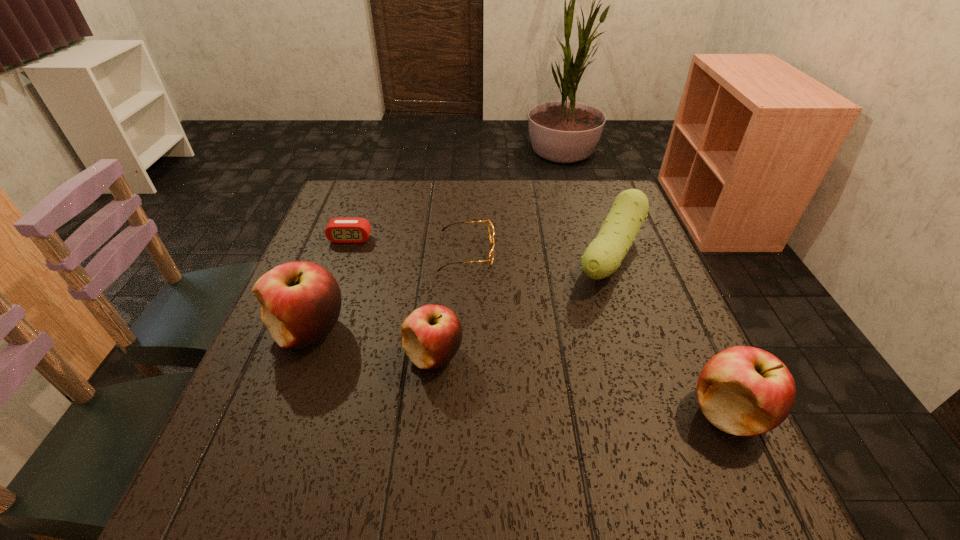
You are a GUI agent. You are given a task and a screenshot of the screen. Output one action in this format:
    pyautogui.click(x=<x>, y=<y>)
    Task: Click on the apple that is the third closest to the alarm clock
    
    Given the screenshot: What is the action you would take?
    pyautogui.click(x=744, y=391)

Locate an element on the screen. This screenshot has height=540, width=960. vacant space that satisfies the following two spatial constraints: 1. on the front-facing side of the spectacles; 2. on the right side of the cucumber is located at coordinates (467, 255).

The image size is (960, 540). Find the location of `vacant position in the image that satisfies the following two spatial constraints: 1. on the front-facing side of the second apple from right to left; 2. on the left side of the alarm clock`. vacant position in the image that satisfies the following two spatial constraints: 1. on the front-facing side of the second apple from right to left; 2. on the left side of the alarm clock is located at coordinates (308, 355).

In order to click on free space that satisfies the following two spatial constraints: 1. on the back side of the cucumber; 2. on the front-facing side of the spectacles in this screenshot , I will do `click(610, 252)`.

You are a GUI agent. You are given a task and a screenshot of the screen. Output one action in this format:
    pyautogui.click(x=<x>, y=<y>)
    Task: Click on the free space that satisfies the following two spatial constraints: 1. on the front-facing side of the alarm clock; 2. on the left side of the rightmost apple
    
    Given the screenshot: What is the action you would take?
    pyautogui.click(x=288, y=412)

Image resolution: width=960 pixels, height=540 pixels. Find the location of `vacant space that satisfies the following two spatial constraints: 1. on the front-facing side of the alarm clock; 2. on the left side of the second tallest object`. vacant space that satisfies the following two spatial constraints: 1. on the front-facing side of the alarm clock; 2. on the left side of the second tallest object is located at coordinates (288, 412).

Image resolution: width=960 pixels, height=540 pixels. I want to click on free space that satisfies the following two spatial constraints: 1. on the front side of the rightmost apple; 2. on the right side of the leftmost apple, so click(277, 412).

Image resolution: width=960 pixels, height=540 pixels. What are the coordinates of `free space that satisfies the following two spatial constraints: 1. on the front-facing side of the rightmost apple; 2. on the right side of the alarm clock` in the screenshot? It's located at (288, 412).

The width and height of the screenshot is (960, 540). What are the coordinates of `vacant space that satisfies the following two spatial constraints: 1. on the front-facing side of the alarm clock; 2. on the right side of the cucumber` in the screenshot? It's located at (344, 255).

The image size is (960, 540). I want to click on free location that satisfies the following two spatial constraints: 1. on the front-facing side of the alarm clock; 2. on the right side of the shortest apple, so click(x=308, y=355).